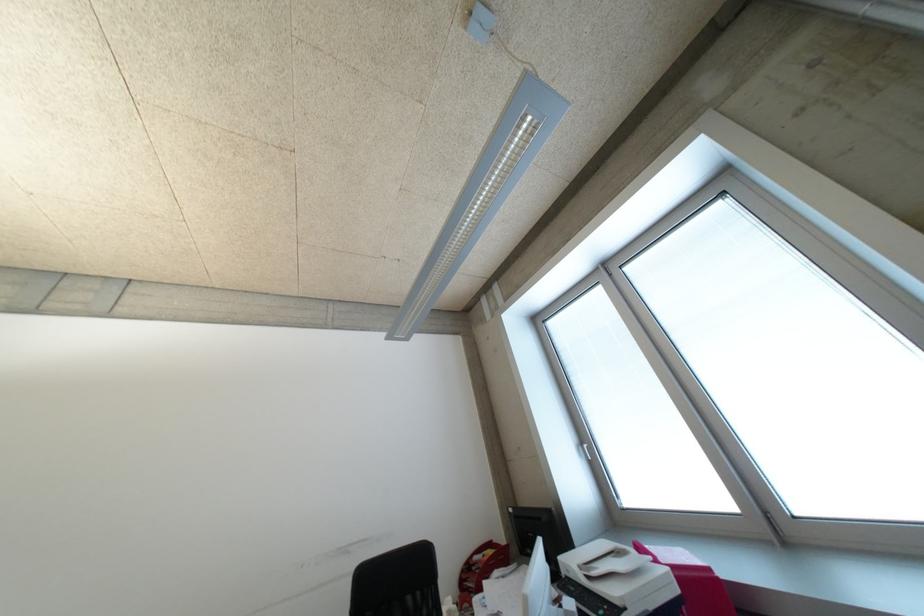
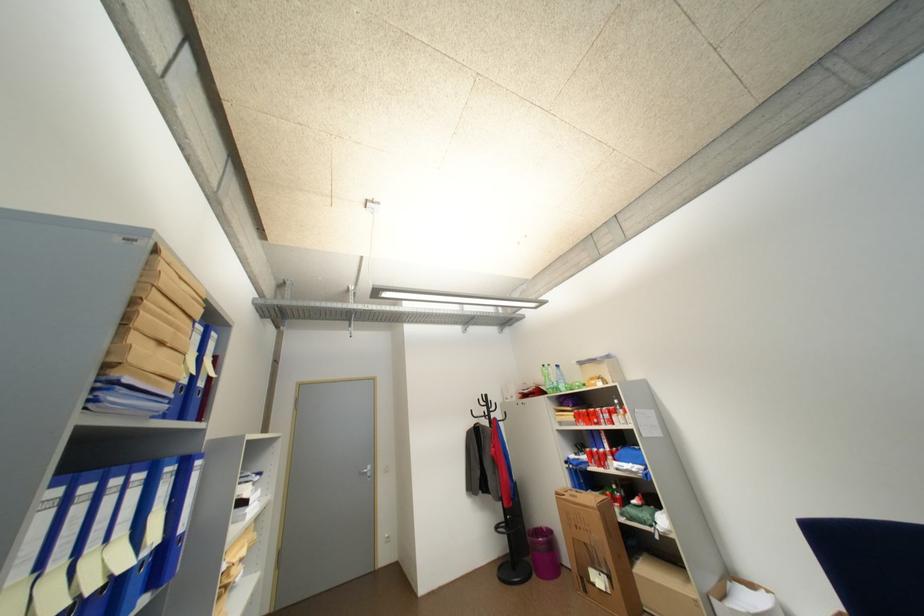
Question: How did the camera likely rotate?

Choices:
 (A) Left
 (B) Right
 (C) Up
 (D) Down

Answer: (A)